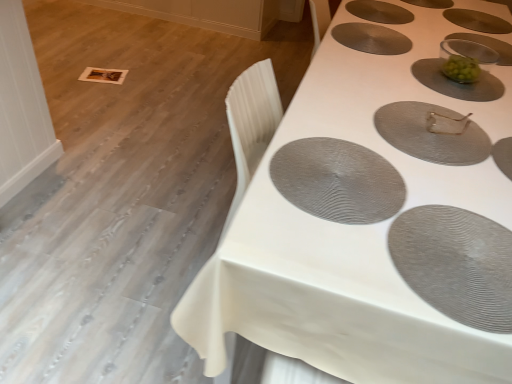
Where is `blank space to the left of matte gray placemat at center, placed as the third oval when sorted from front to back`? blank space to the left of matte gray placemat at center, placed as the third oval when sorted from front to back is located at coordinates (x=336, y=105).